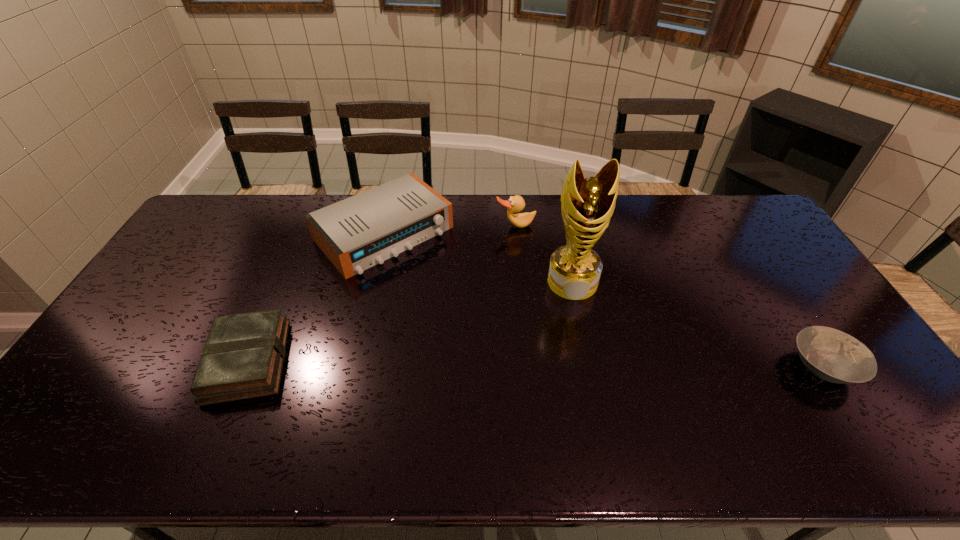
The height and width of the screenshot is (540, 960). What are the coordinates of `blank region between the radio receiver and the fourth shortest object` in the screenshot? It's located at (449, 229).

Locate an element on the screen. This screenshot has width=960, height=540. empty space between the book and the fourth shortest object is located at coordinates (381, 293).

Identify the location of free space between the third shortest object and the book. This screenshot has height=540, width=960. (316, 297).

The width and height of the screenshot is (960, 540). What are the coordinates of `vacant area that lies between the fourth object from left to right and the duck` in the screenshot? It's located at (544, 254).

This screenshot has height=540, width=960. I want to click on free space between the rightmost object and the book, so click(536, 363).

The height and width of the screenshot is (540, 960). In order to click on free space between the book and the duck in this screenshot , I will do `click(381, 293)`.

Find the location of `unoccupied area between the third shortest object and the book`. unoccupied area between the third shortest object and the book is located at coordinates (316, 297).

Where is `free space between the third tallest object and the award`? free space between the third tallest object and the award is located at coordinates (478, 258).

At what (x,y) coordinates should I click in order to perform the action: click on free space between the third object from left to right and the bowl. Please return your answer as a coordinate pair (x, y). Looking at the image, I should click on (669, 296).

I want to click on free space between the rightmost object and the award, so click(x=698, y=325).